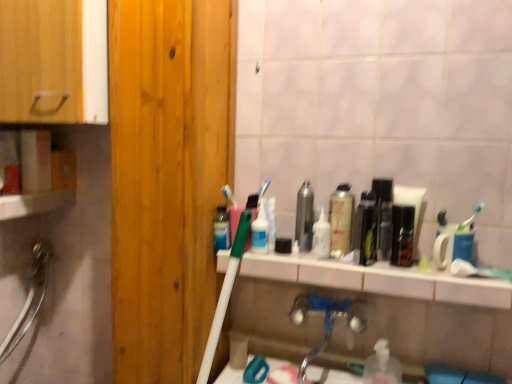
Question: Which is correct: green plastic mouthwash at center, which appears as the fifth mouthwash when viewed from the right, is inside white glossy counter top at center, or outside of it?

Choices:
 (A) outside
 (B) inside

Answer: (A)

Question: From the image's perspective, is green plastic mouthwash at center, which appears as the fifth mouthwash when viewed from the right, located above or below white glossy counter top at center?

Choices:
 (A) above
 (B) below

Answer: (A)

Question: Which object is positioned closest to the silver metallic faucet at lower center?

Choices:
 (A) white glossy counter top at center
 (B) clear plastic bottle at lower center, the 2th mouthwash positioned from the right
 (C) light brown wood door at left
 (D) shiny metallic mouthwash at center, the third mouthwash in the right-to-left sequence
 (E) wooden cabinet at left

Answer: (B)

Question: Which is farther from the wooden cabinet at left?

Choices:
 (A) green plastic mouthwash at center, which appears as the fifth mouthwash when viewed from the right
 (B) white glossy toothpaste tube at center, positioned as the 2th toiletry in right-to-left order
 (C) white glossy counter top at center
 (D) silver metallic faucet at lower center
 (E) white glossy bottle at center, placed as the first toiletry when sorted from right to left

Answer: (D)